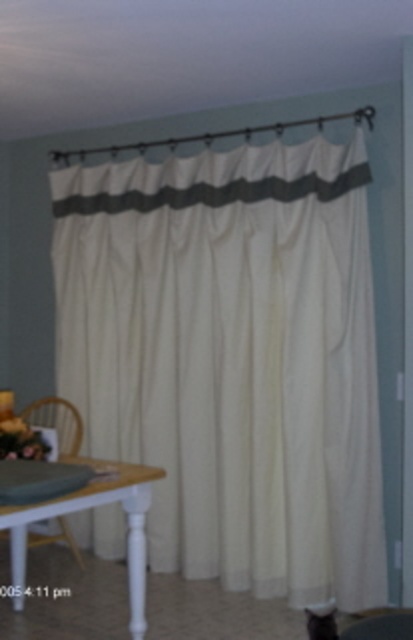
Question: Which object appears farthest from the camera in this image?

Choices:
 (A) fluffy white cat at lower center
 (B) wooden armchair at lower left
 (C) white textured curtain at center
 (D) white glossy table at lower left

Answer: (B)

Question: Which object is positioned farthest from the white textured curtain at center?

Choices:
 (A) fluffy white cat at lower center
 (B) wooden armchair at lower left
 (C) white glossy table at lower left

Answer: (A)

Question: Does white glossy table at lower left have a larger size compared to fluffy white cat at lower center?

Choices:
 (A) yes
 (B) no

Answer: (A)

Question: Which of these objects is positioned farthest from the fluffy white cat at lower center?

Choices:
 (A) white textured curtain at center
 (B) white glossy table at lower left
 (C) wooden armchair at lower left

Answer: (C)

Question: Is white textured curtain at center smaller than wooden armchair at lower left?

Choices:
 (A) yes
 (B) no

Answer: (B)

Question: Does white textured curtain at center have a smaller size compared to wooden armchair at lower left?

Choices:
 (A) no
 (B) yes

Answer: (A)